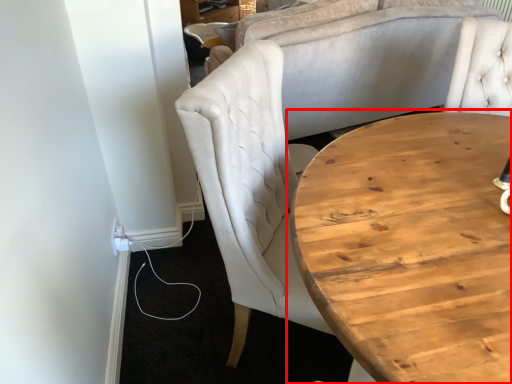
Question: From the image's perspective, where is coffee table (annotated by the red box) located relative to chair?

Choices:
 (A) above
 (B) below

Answer: (B)